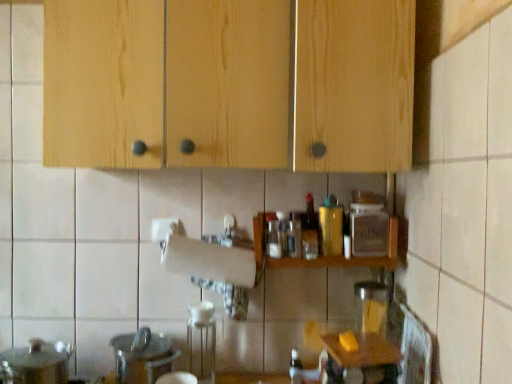
Locate an element on the screen. wooden spice rack at center is located at coordinates (322, 256).

This screenshot has height=384, width=512. In order to click on white glossy sink at lower left in this screenshot , I will do `click(142, 356)`.

The width and height of the screenshot is (512, 384). What are the coordinates of `gold metallic canister at center, positioned as the 2th bottle in top-to-bottom order` in the screenshot? It's located at (331, 226).

Describe the element at coordinates (208, 260) in the screenshot. I see `white matte paper towel at center` at that location.

What is the approximate height of wooden table at lower right?

wooden table at lower right is 8.55 inches in height.

The height and width of the screenshot is (384, 512). I want to click on translucent plastic bottle at center, which ranks as the first bottle in top-to-bottom order, so click(310, 230).

You are a GUI agent. You are given a task and a screenshot of the screen. Output one action in this format:
    pyautogui.click(x=<x>, y=<y>)
    Task: Click on the wooden spice rack at center
    
    Given the screenshot: What is the action you would take?
    pyautogui.click(x=322, y=256)

Is natural wood cabinets at upper center in contact with gold metallic canister at center, the 2th bottle ordered from the bottom?

No, natural wood cabinets at upper center is not with gold metallic canister at center, the 2th bottle ordered from the bottom.

Is gold metallic canister at center, the 2th bottle ordered from the bottom, at the back of natural wood cabinets at upper center?

natural wood cabinets at upper center does not have its back to gold metallic canister at center, the 2th bottle ordered from the bottom.

Where is `cabinetry located above the gold metallic canister at center, positioned as the 2th bottle in top-to-bottom order (from the image's perspective)`? The image size is (512, 384). cabinetry located above the gold metallic canister at center, positioned as the 2th bottle in top-to-bottom order (from the image's perspective) is located at coordinates (229, 83).

Is natural wood cabinets at upper center wider than gold metallic canister at center, the 2th bottle ordered from the bottom?

Correct, the width of natural wood cabinets at upper center exceeds that of gold metallic canister at center, the 2th bottle ordered from the bottom.

Would you say gold metallic canister at center, positioned as the 2th bottle in top-to-bottom order, is to the left or to the right of white matte paper towel at center in the picture?

Clearly, gold metallic canister at center, positioned as the 2th bottle in top-to-bottom order, is on the right of white matte paper towel at center in the image.

Locate an element on the screen. paper towel that is on the left side of gold metallic canister at center, the 2th bottle ordered from the bottom is located at coordinates (208, 260).

Which point is more forward, (x=328, y=231) or (x=186, y=260)?

The point (x=186, y=260) is in front.

Between gold metallic canister at center, positioned as the 2th bottle in top-to-bottom order, and white matte paper towel at center, which one has smaller width?

With smaller width is white matte paper towel at center.

Considering the positions of objects natural wood cabinets at upper center and translucent plastic bottle at center, which ranks as the first bottle in top-to-bottom order, in the image provided, who is more to the left, natural wood cabinets at upper center or translucent plastic bottle at center, which ranks as the first bottle in top-to-bottom order,?

Positioned to the left is natural wood cabinets at upper center.

From the picture: From a real-world perspective, between natural wood cabinets at upper center and translucent plastic bottle at center, which ranks as the first bottle in top-to-bottom order, who is vertically higher?

natural wood cabinets at upper center, from a real-world perspective.

Consider the image. Considering the relative sizes of natural wood cabinets at upper center and translucent plastic bottle at center, which is counted as the 3th bottle, starting from the bottom, in the image provided, is natural wood cabinets at upper center shorter than translucent plastic bottle at center, which is counted as the 3th bottle, starting from the bottom,?

No.

Considering their positions, is natural wood cabinets at upper center located in front of or behind translucent plastic bottle at center, which ranks as the first bottle in top-to-bottom order?

Clearly, natural wood cabinets at upper center is in front of translucent plastic bottle at center, which ranks as the first bottle in top-to-bottom order.

Considering the positions of point (331, 227) and point (312, 196), is point (331, 227) closer or farther from the camera than point (312, 196)?

Point (331, 227) is closer to the camera than point (312, 196).

From the image's perspective, is gold metallic canister at center, positioned as the 2th bottle in top-to-bottom order, above or below translucent plastic bottle at center, which ranks as the first bottle in top-to-bottom order?

From the image's perspective, gold metallic canister at center, positioned as the 2th bottle in top-to-bottom order, appears below translucent plastic bottle at center, which ranks as the first bottle in top-to-bottom order.

Which is more to the left, gold metallic canister at center, positioned as the 2th bottle in top-to-bottom order, or translucent plastic bottle at center, which ranks as the first bottle in top-to-bottom order?

translucent plastic bottle at center, which ranks as the first bottle in top-to-bottom order.

Where is `bottle lying above the gold metallic canister at center, the 2th bottle ordered from the bottom (from the image's perspective)`? bottle lying above the gold metallic canister at center, the 2th bottle ordered from the bottom (from the image's perspective) is located at coordinates (310, 230).

Which object is positioned more to the left, white matte paper towel at center or wooden spice rack at center?

Positioned to the left is white matte paper towel at center.

Which of these two, white matte paper towel at center or wooden spice rack at center, stands shorter?

white matte paper towel at center.

You are a GUI agent. You are given a task and a screenshot of the screen. Output one action in this format:
    pyautogui.click(x=<x>, y=<y>)
    Task: Click on the paper towel lying on the left of wooden spice rack at center
    The image size is (512, 384).
    Given the screenshot: What is the action you would take?
    pyautogui.click(x=208, y=260)

Between translucent glass bottle at lower center, which is counted as the first bottle, starting from the bottom, and gold metallic canister at center, the 2th bottle ordered from the bottom, which one has smaller size?

With smaller size is translucent glass bottle at lower center, which is counted as the first bottle, starting from the bottom.

Which object is further away from the camera taking this photo, translucent glass bottle at lower center, which is counted as the first bottle, starting from the bottom, or gold metallic canister at center, positioned as the 2th bottle in top-to-bottom order?

translucent glass bottle at lower center, which is counted as the first bottle, starting from the bottom.

Which of these two, translucent glass bottle at lower center, which is counted as the first bottle, starting from the bottom, or gold metallic canister at center, the 2th bottle ordered from the bottom, is wider?

With larger width is gold metallic canister at center, the 2th bottle ordered from the bottom.

Does translucent glass bottle at lower center, which is counted as the first bottle, starting from the bottom, appear on the right side of gold metallic canister at center, the 2th bottle ordered from the bottom?

Incorrect, translucent glass bottle at lower center, which is counted as the first bottle, starting from the bottom, is not on the right side of gold metallic canister at center, the 2th bottle ordered from the bottom.

From the image's perspective, is wooden spice rack at center above white glossy sink at lower left?

Correct, wooden spice rack at center appears higher than white glossy sink at lower left in the image.

In the scene shown: Who is taller, wooden spice rack at center or white glossy sink at lower left?

With more height is white glossy sink at lower left.

Does wooden spice rack at center appear on the right side of white glossy sink at lower left?

Yes.

Is wooden spice rack at center positioned with its back to white glossy sink at lower left?

wooden spice rack at center is not turned away from white glossy sink at lower left.

Where is `cabinetry that is in front of the gold metallic canister at center, the 2th bottle ordered from the bottom`? The height and width of the screenshot is (384, 512). cabinetry that is in front of the gold metallic canister at center, the 2th bottle ordered from the bottom is located at coordinates (229, 83).

Identify the location of the 3rd bottle to the right when counting from the white matte paper towel at center. The image size is (512, 384). (331, 226).

Estimate the real-world distances between objects in this image. Which object is further from white matte paper towel at center, translucent plastic bottle at center, which is counted as the 3th bottle, starting from the bottom, or gold metallic canister at center, the 2th bottle ordered from the bottom?

The object further to white matte paper towel at center is gold metallic canister at center, the 2th bottle ordered from the bottom.

In the scene shown: Based on their spatial positions, is translucent plastic bottle at center, which ranks as the first bottle in top-to-bottom order, or natural wood cabinets at upper center closer to white glossy sink at lower left?

translucent plastic bottle at center, which ranks as the first bottle in top-to-bottom order, lies closer to white glossy sink at lower left than the other object.

Considering their positions, is wooden spice rack at center positioned closer to gold metallic canister at center, positioned as the 2th bottle in top-to-bottom order, than translucent plastic bottle at center, which ranks as the first bottle in top-to-bottom order?

translucent plastic bottle at center, which ranks as the first bottle in top-to-bottom order, lies closer to gold metallic canister at center, positioned as the 2th bottle in top-to-bottom order, than the other object.

Considering their positions, is wooden table at lower right positioned closer to translucent plastic bottle at center, which ranks as the first bottle in top-to-bottom order, than wooden spice rack at center?

Based on the image, wooden spice rack at center appears to be nearer to translucent plastic bottle at center, which ranks as the first bottle in top-to-bottom order.

Considering their positions, is white matte paper towel at center positioned closer to wooden spice rack at center than translucent glass bottle at lower center, which is counted as the first bottle, starting from the bottom?

The object closer to wooden spice rack at center is white matte paper towel at center.

From the image, which object appears to be farther from gold metallic canister at center, the 2th bottle ordered from the bottom, wooden spice rack at center or wooden table at lower right?

wooden table at lower right is further to gold metallic canister at center, the 2th bottle ordered from the bottom.

In the scene shown: Which object lies nearer to the anchor point translucent plastic bottle at center, which is counted as the 3th bottle, starting from the bottom, wooden table at lower right or translucent glass bottle at lower center, placed as the 3th bottle when sorted from top to bottom?

wooden table at lower right is positioned closer to the anchor translucent plastic bottle at center, which is counted as the 3th bottle, starting from the bottom.

Considering their positions, is wooden table at lower right positioned further to wooden spice rack at center than translucent glass bottle at lower center, which is counted as the first bottle, starting from the bottom?

translucent glass bottle at lower center, which is counted as the first bottle, starting from the bottom, lies further to wooden spice rack at center than the other object.

Locate an element on the screen. The image size is (512, 384). paper towel between white glossy sink at lower left and gold metallic canister at center, the 2th bottle ordered from the bottom is located at coordinates (208, 260).

This screenshot has height=384, width=512. In order to click on shelf between gold metallic canister at center, the 2th bottle ordered from the bottom, and translucent glass bottle at lower center, placed as the 3th bottle when sorted from top to bottom, in the vertical direction in this screenshot , I will do [322, 256].

The image size is (512, 384). In order to click on shelf situated between white matte paper towel at center and gold metallic canister at center, the 2th bottle ordered from the bottom, from left to right in this screenshot , I will do `click(322, 256)`.

Where is `paper towel between natural wood cabinets at upper center and wooden table at lower right in the up-down direction`? Image resolution: width=512 pixels, height=384 pixels. paper towel between natural wood cabinets at upper center and wooden table at lower right in the up-down direction is located at coordinates (208, 260).